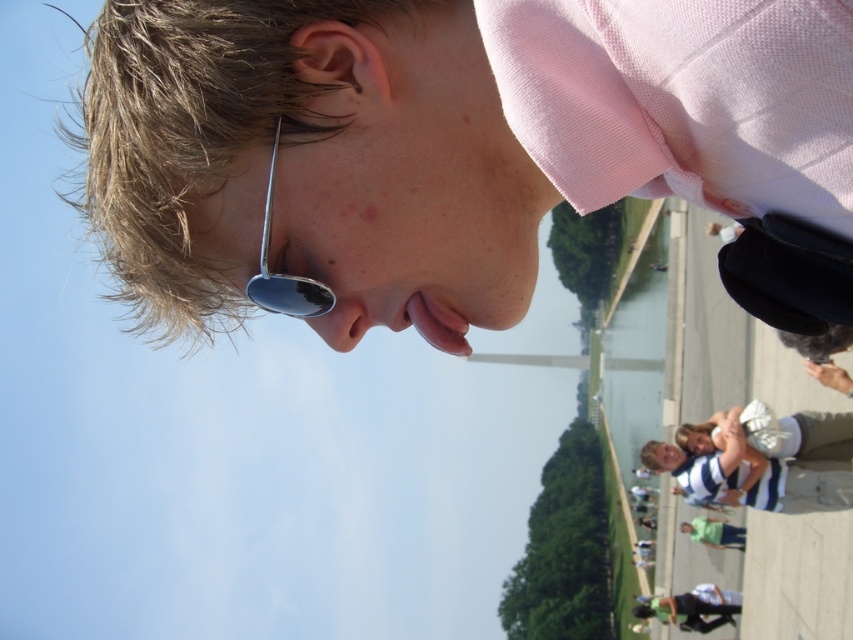
Is point (358, 81) in front of point (303, 278)?

Yes.

Does pink cotton shirt at upper center lie in front of metallic reflective sunglasses at center?

Yes, it is.

Between point (109, 193) and point (251, 298), which one is positioned in front?

Point (251, 298) is in front.

This screenshot has width=853, height=640. In order to click on pink cotton shirt at upper center in this screenshot , I will do `click(456, 150)`.